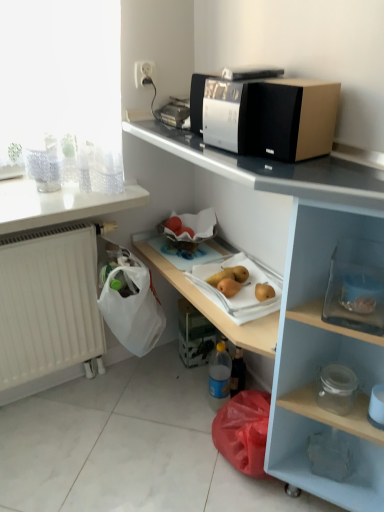
Where is `blank space situated above silver metallic microwave at upper center (from a real-world perspective)`? The width and height of the screenshot is (384, 512). blank space situated above silver metallic microwave at upper center (from a real-world perspective) is located at coordinates (247, 76).